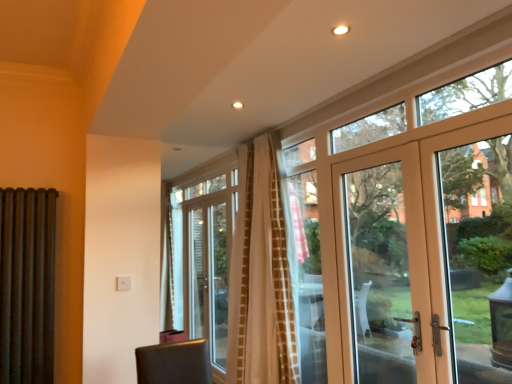
This screenshot has height=384, width=512. Find the location of `clear glass door at upper right`. clear glass door at upper right is located at coordinates (466, 94).

Describe the element at coordinates (27, 285) in the screenshot. I see `rusty metal radiator at left` at that location.

Locate an element on the screen. The image size is (512, 384). clear glass door at upper right is located at coordinates (466, 94).

Between matte white door at right and rusty metal radiator at left, which one has less height?

rusty metal radiator at left.

Looking at this image, between matte white door at right and rusty metal radiator at left, which one has smaller size?

rusty metal radiator at left.

Is matte white door at right in front of rusty metal radiator at left?

Yes, the depth of matte white door at right is less than that of rusty metal radiator at left.

Which is further, (346, 219) or (44, 292)?

The point (346, 219) is farther.

Is clear glass door at upper right next to matte white door at right?

No, clear glass door at upper right is not in contact with matte white door at right.

Which is more to the left, clear glass door at upper right or matte white door at right?

From the viewer's perspective, clear glass door at upper right appears more on the left side.

Is matte white door at right a part of clear glass door at upper right?

No, matte white door at right is not inside clear glass door at upper right.

At what (x,y) coordinates should I click in order to perform the action: click on door below the clear glass door at upper right (from a real-world perspective). Please return your answer as a coordinate pair (x, y). This screenshot has width=512, height=384. Looking at the image, I should click on (425, 258).

Can you confirm if white textured curtain at center is wider than rusty metal radiator at left?

Indeed, white textured curtain at center has a greater width compared to rusty metal radiator at left.

Based on the photo, looking at the image, does white textured curtain at center seem bigger or smaller compared to rusty metal radiator at left?

Clearly, white textured curtain at center is larger in size than rusty metal radiator at left.

Can we say white textured curtain at center lies outside rusty metal radiator at left?

That's correct, white textured curtain at center is outside of rusty metal radiator at left.

From the image's perspective, is clear glass door at upper right on white textured curtain at center?

Yes, from the image's perspective, clear glass door at upper right is above white textured curtain at center.

Is clear glass door at upper right aimed at white textured curtain at center?

No, clear glass door at upper right is not oriented towards white textured curtain at center.

Is clear glass door at upper right positioned before white textured curtain at center?

Yes, it is in front of white textured curtain at center.

How many degrees apart are the facing directions of clear glass door at upper right and white textured curtain at center?

The facing directions of clear glass door at upper right and white textured curtain at center are 0.551 degrees apart.

Looking at this image, is clear glass door at upper right at the right side of rusty metal radiator at left?

Yes, clear glass door at upper right is to the right of rusty metal radiator at left.

From a real-world perspective, who is located lower, clear glass door at upper right or rusty metal radiator at left?

In real-world perspective, rusty metal radiator at left is lower.

Between clear glass door at upper right and rusty metal radiator at left, which one is positioned in front?

Positioned in front is clear glass door at upper right.

Who is bigger, clear glass door at upper right or rusty metal radiator at left?

rusty metal radiator at left.

Where is `curtain located on the left of matte white door at right`? The image size is (512, 384). curtain located on the left of matte white door at right is located at coordinates (261, 273).

Which is less distant, (245, 236) or (339, 197)?

Point (245, 236) is positioned farther from the camera compared to point (339, 197).

Is white textured curtain at center bigger than matte white door at right?

Yes.

Which is correct: white textured curtain at center is inside matte white door at right, or outside of it?

white textured curtain at center is not enclosed by matte white door at right.

Where is `curtain below the matte white door at right (from the image's perspective)`? This screenshot has height=384, width=512. curtain below the matte white door at right (from the image's perspective) is located at coordinates (261, 273).

Considering the sizes of matte white door at right and white textured curtain at center in the image, is matte white door at right bigger or smaller than white textured curtain at center?

Considering their sizes, matte white door at right takes up less space than white textured curtain at center.

Between matte white door at right and white textured curtain at center, which one is positioned behind?

white textured curtain at center is behind.

Is matte white door at right looking in the opposite direction of white textured curtain at center?

No, matte white door at right is not facing away from white textured curtain at center.

The height and width of the screenshot is (384, 512). In order to click on shutter to the left of matte white door at right in this screenshot , I will do `click(27, 285)`.

Identify the location of window behind the matte white door at right. (466, 94).

Which object lies further to the anchor point clear glass door at upper right, white textured curtain at center or matte white door at right?

white textured curtain at center lies further to clear glass door at upper right than the other object.

Based on their spatial positions, is white textured curtain at center or rusty metal radiator at left closer to clear glass door at upper right?

The object closer to clear glass door at upper right is white textured curtain at center.

Looking at the image, which one is located further to matte white door at right, rusty metal radiator at left or clear glass door at upper right?

The object further to matte white door at right is rusty metal radiator at left.

Which object lies further to the anchor point matte white door at right, white textured curtain at center or clear glass door at upper right?

The object further to matte white door at right is white textured curtain at center.

From the image, which object appears to be nearer to rusty metal radiator at left, matte white door at right or clear glass door at upper right?

Based on the image, clear glass door at upper right appears to be nearer to rusty metal radiator at left.

Based on their spatial positions, is rusty metal radiator at left or clear glass door at upper right closer to white textured curtain at center?

Among the two, clear glass door at upper right is located nearer to white textured curtain at center.

Estimate the real-world distances between objects in this image. Which object is closer to clear glass door at upper right, rusty metal radiator at left or white textured curtain at center?

white textured curtain at center.

Looking at the image, which one is located closer to rusty metal radiator at left, clear glass door at upper right or matte white door at right?

clear glass door at upper right lies closer to rusty metal radiator at left than the other object.

You are a GUI agent. You are given a task and a screenshot of the screen. Output one action in this format:
    pyautogui.click(x=<x>, y=<y>)
    Task: Click on the curtain between rusty metal radiator at left and matte white door at right from left to right
    This screenshot has width=512, height=384.
    Given the screenshot: What is the action you would take?
    261,273

The image size is (512, 384). What are the coordinates of `window positioned between matte white door at right and white textured curtain at center from near to far` in the screenshot? It's located at (466, 94).

Where is `curtain between rusty metal radiator at left and clear glass door at upper right in the horizontal direction`? Image resolution: width=512 pixels, height=384 pixels. curtain between rusty metal radiator at left and clear glass door at upper right in the horizontal direction is located at coordinates (261, 273).

Where is `window between rusty metal radiator at left and matte white door at right in the horizontal direction`? window between rusty metal radiator at left and matte white door at right in the horizontal direction is located at coordinates (466, 94).